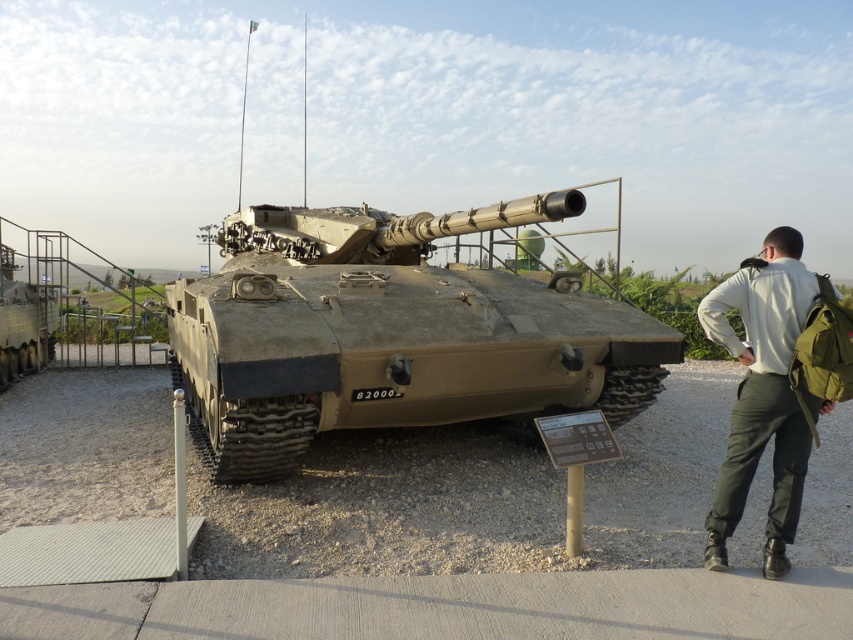
Is camouflage textured tank at center wider than khaki fabric pants at right?

Indeed, camouflage textured tank at center has a greater width compared to khaki fabric pants at right.

Who is lower down, camouflage textured tank at center or khaki fabric pants at right?

khaki fabric pants at right is below.

Locate an element on the screen. camouflage textured tank at center is located at coordinates (392, 333).

Where is `camouflage textured tank at center`? camouflage textured tank at center is located at coordinates (392, 333).